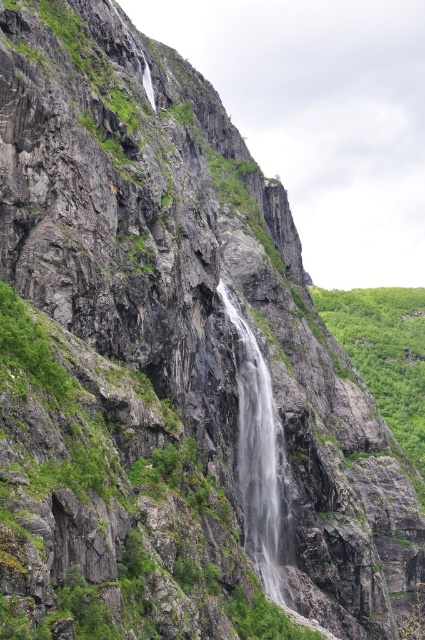
The height and width of the screenshot is (640, 425). Describe the element at coordinates (112, 502) in the screenshot. I see `green mossy rock at center` at that location.

Who is more forward, (107, 419) or (251, 339)?

Point (107, 419) is in front.

Find the location of a particular element. Image resolution: width=425 pixels, height=640 pixels. green mossy rock at center is located at coordinates [x=112, y=502].